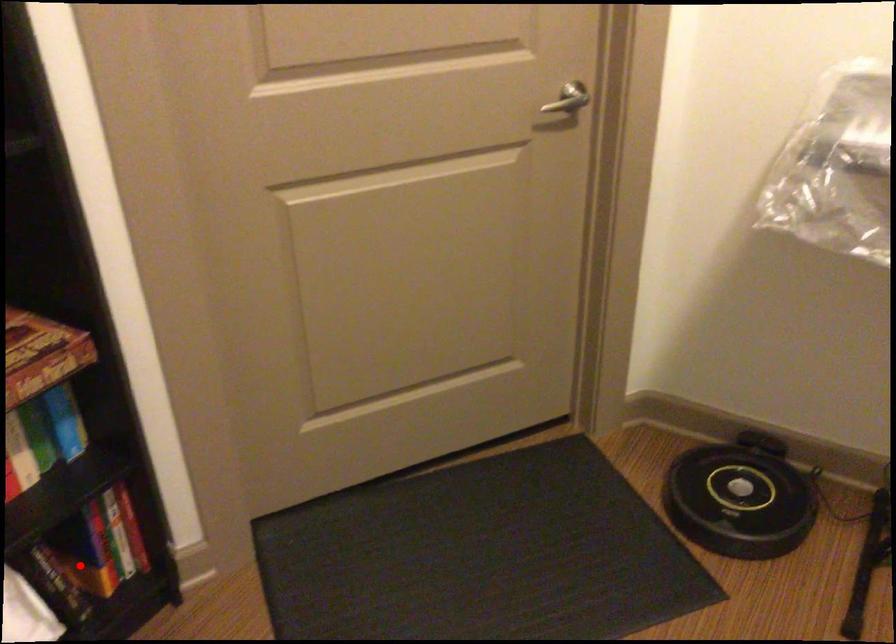
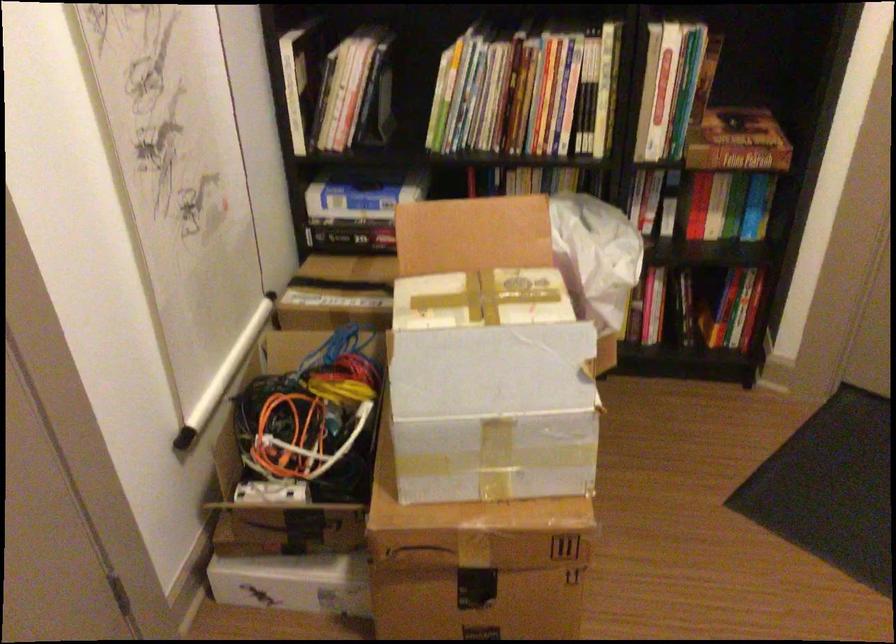
Question: I am providing you with two images of the same scene from different viewpoints. A red point is shown in image1. For the corresponding object point in image2, is it positioned nearer or farther from the camera?

Choices:
 (A) Nearer
 (B) Farther

Answer: (B)